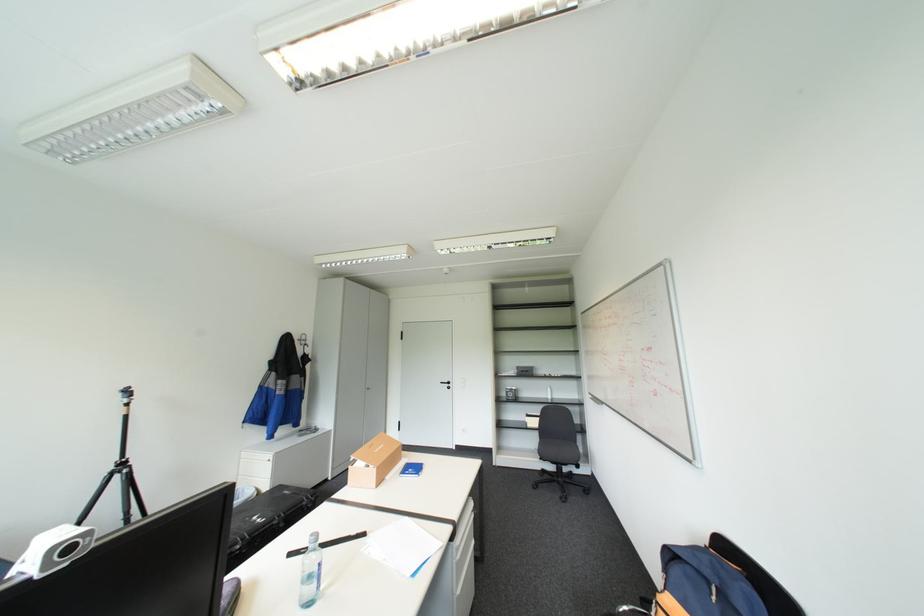
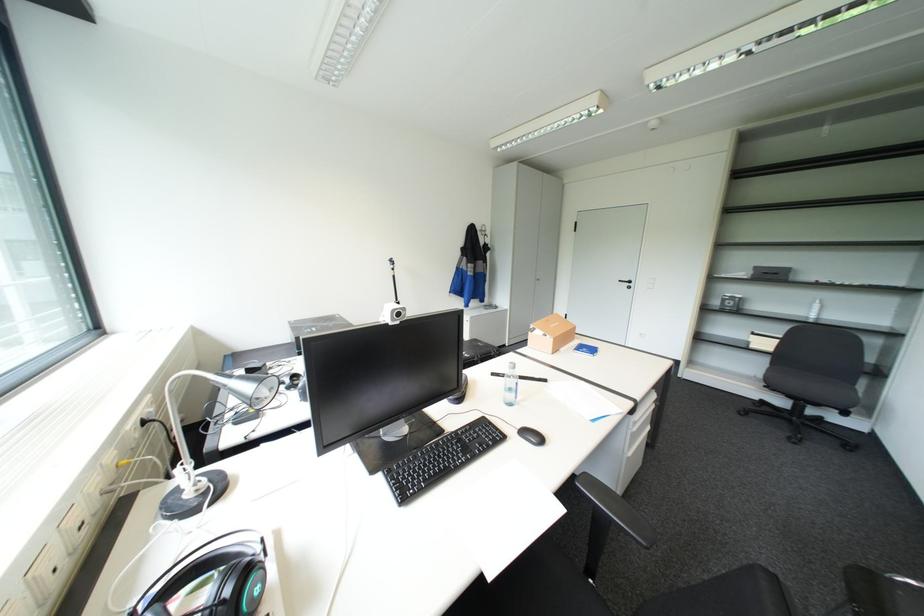
The first image is from the beginning of the video and the second image is from the end. How did the camera likely rotate when shooting the video?

The rotation direction of the camera is left-down.